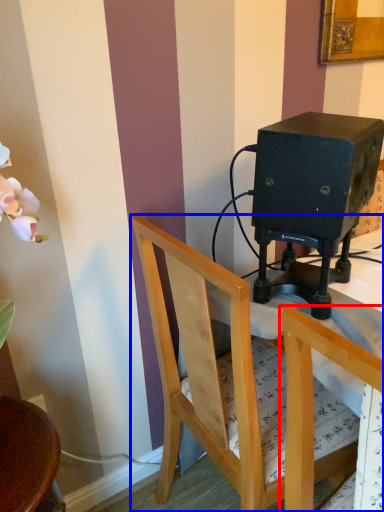
Question: Which point is further to the camera, chair (highlighted by a red box) or chair (highlighted by a blue box)?

Choices:
 (A) chair
 (B) chair

Answer: (B)